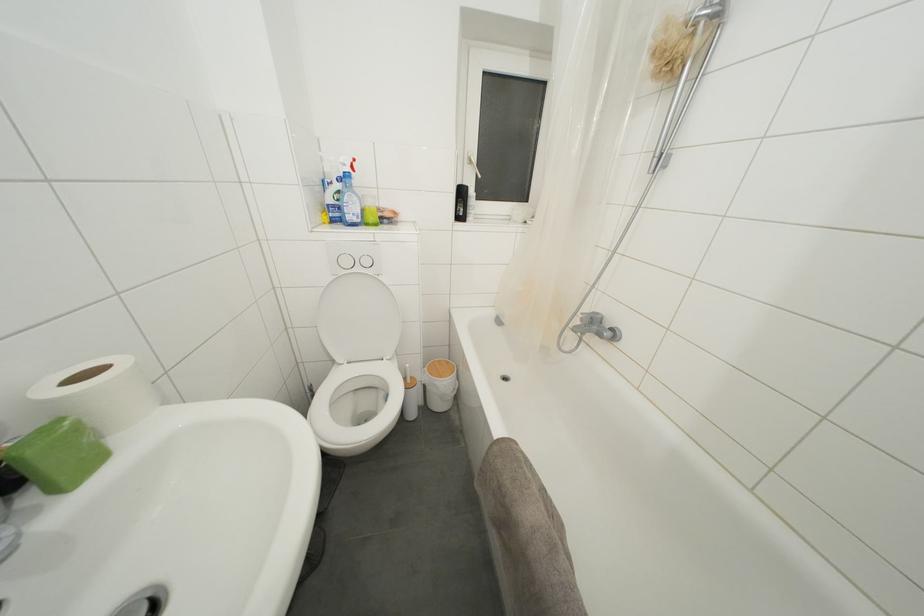
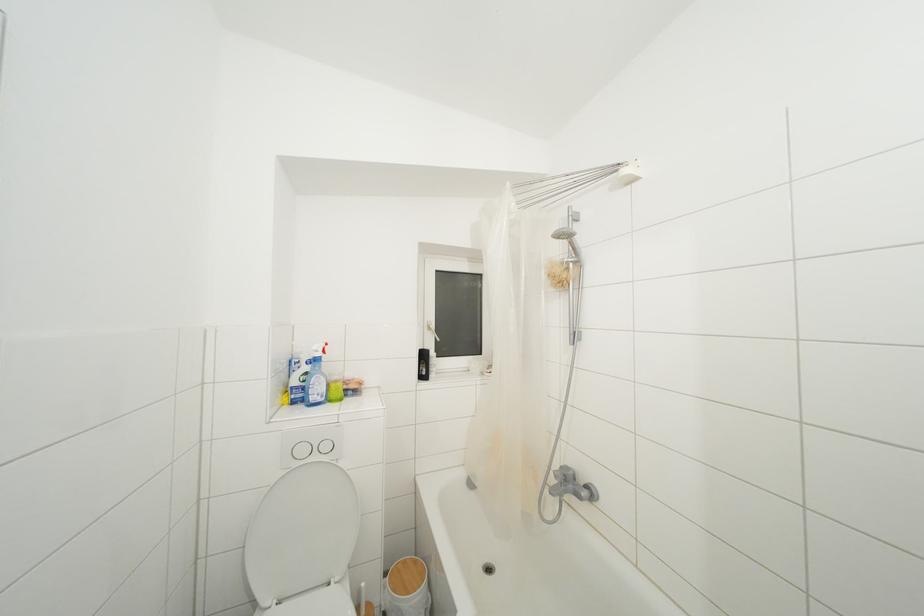
Locate, in the second image, the point that corresponds to pixel 417 382 in the first image.

(371, 610)